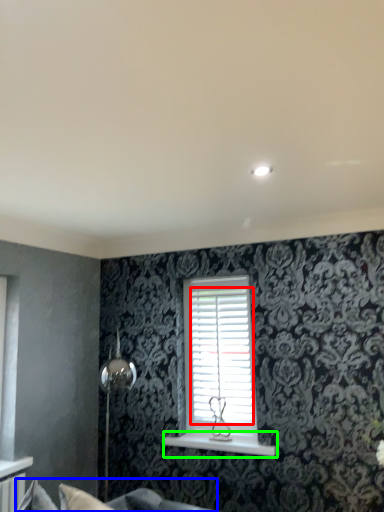
Question: Which object is the farthest from shutter (highlighted by a red box)? Choose among these: couch (highlighted by a blue box) or window sill (highlighted by a green box).

Choices:
 (A) couch
 (B) window sill

Answer: (A)